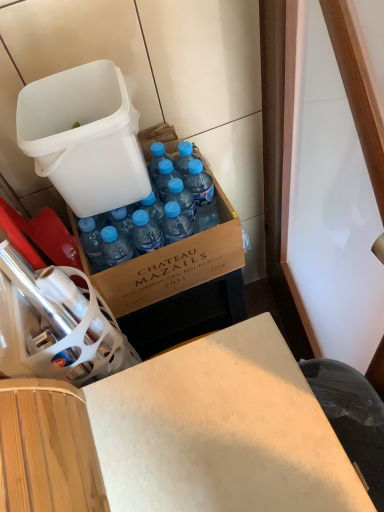
Question: Considering the relative positions of wooden desk at center and blue plastic bottle at center in the image provided, is wooden desk at center to the left or to the right of blue plastic bottle at center?

Choices:
 (A) left
 (B) right

Answer: (A)

Question: Considering the positions of point (324, 423) and point (206, 214), is point (324, 423) closer or farther from the camera than point (206, 214)?

Choices:
 (A) closer
 (B) farther

Answer: (A)

Question: Which object is positioned closest to the blue plastic bottle at center?

Choices:
 (A) wooden desk at center
 (B) white plastic trash can at upper left

Answer: (B)

Question: Estimate the real-world distances between objects in this image. Which object is closer to the white plastic trash can at upper left?

Choices:
 (A) blue plastic bottle at center
 (B) wooden desk at center

Answer: (A)